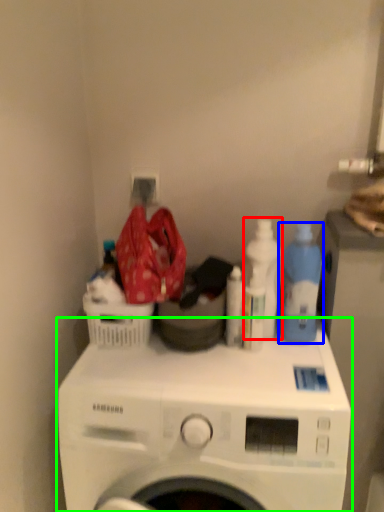
Question: Which object is the closest to the cleaning product (highlighted by a red box)? Choose among these: cleaning product (highlighted by a blue box) or washing machine (highlighted by a green box).

Choices:
 (A) cleaning product
 (B) washing machine

Answer: (A)